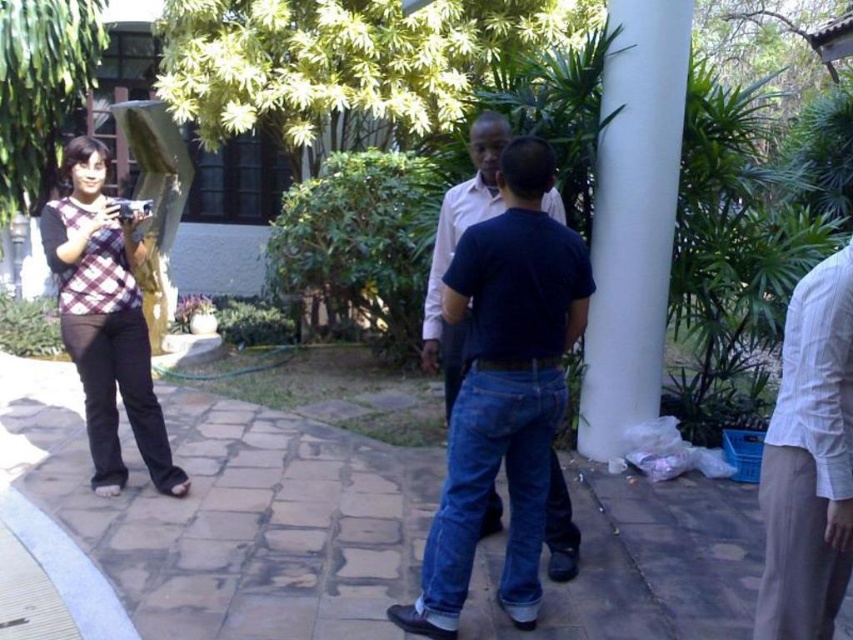
Is white smooth pillar at center right closer to the viewer compared to white cotton shirt at right?

No, white smooth pillar at center right is further to the viewer.

Is white smooth pillar at center right smaller than white cotton shirt at right?

No, white smooth pillar at center right is not smaller than white cotton shirt at right.

Locate an element on the screen. Image resolution: width=853 pixels, height=640 pixels. white smooth pillar at center right is located at coordinates (633, 218).

From the picture: Is white cotton shirt at right below plaid fabric top at left?

Correct, white cotton shirt at right is located below plaid fabric top at left.

Locate an element on the screen. Image resolution: width=853 pixels, height=640 pixels. white cotton shirt at right is located at coordinates (809, 461).

Can you confirm if white cotton shirt at right is positioned above dark blue cotton shirt at center?

Actually, white cotton shirt at right is below dark blue cotton shirt at center.

Find the location of `white cotton shirt at right`. white cotton shirt at right is located at coordinates (809, 461).